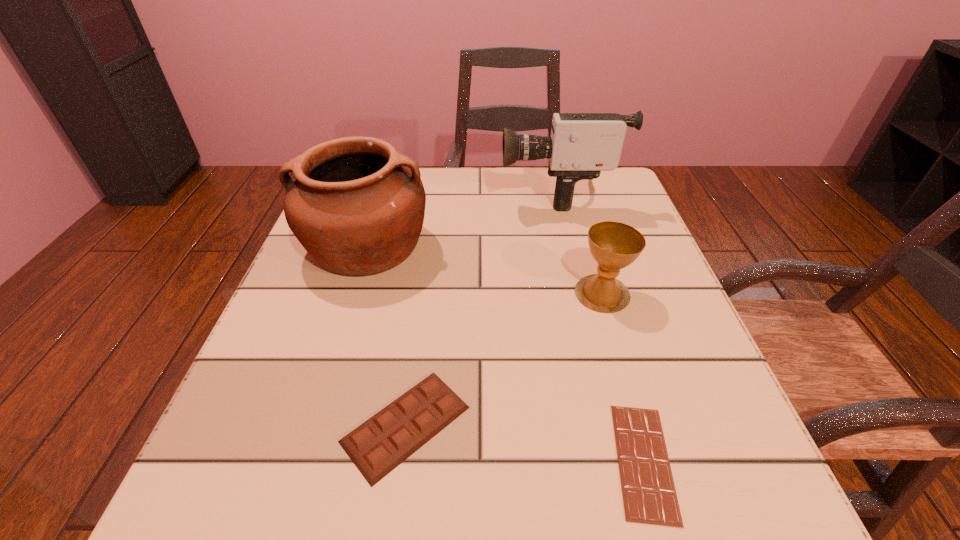
Find the location of a particular element. Image resolution: width=960 pixels, height=540 pixels. free point between the pottery and the taller chocolate bar is located at coordinates (386, 335).

Locate an element on the screen. vacant region between the left chocolate bar and the right chocolate bar is located at coordinates (525, 443).

Find the location of `blank region between the chalice and the camcorder`. blank region between the chalice and the camcorder is located at coordinates (580, 243).

At what (x,y) coordinates should I click in order to perform the action: click on empty space between the pottery and the second shortest object. Please return your answer as a coordinate pair (x, y). Looking at the image, I should click on (386, 335).

At what (x,y) coordinates should I click in order to perform the action: click on free spot between the camcorder and the third tallest object. Please return your answer as a coordinate pair (x, y). The width and height of the screenshot is (960, 540). Looking at the image, I should click on (580, 243).

I want to click on unoccupied position between the left chocolate bar and the shorter chocolate bar, so click(525, 443).

The image size is (960, 540). Identify the location of vacant region between the camcorder and the shortest object. (600, 327).

Identify the location of free space between the taller chocolate bar and the pottery. (386, 335).

Locate which object is the third closest to the left chocolate bar. Please provide its 2D coordinates. Your answer should be formatted as a tuple, i.e. [(x, y)], where the tuple contains the x and y coordinates of a point satisfying the conditions above.

[(614, 245)]

You are a GUI agent. You are given a task and a screenshot of the screen. Output one action in this format:
    pyautogui.click(x=<x>, y=<y>)
    Task: Click on the second closest object to the camcorder
    The image size is (960, 540).
    Given the screenshot: What is the action you would take?
    pyautogui.click(x=614, y=245)